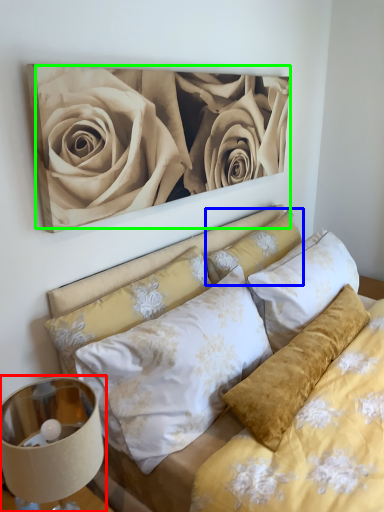
Question: Estimate the real-world distances between objects in this image. Which object is farther from lamp (highlighted by a red box), pillow (highlighted by a blue box) or rose (highlighted by a green box)?

Choices:
 (A) pillow
 (B) rose

Answer: (A)